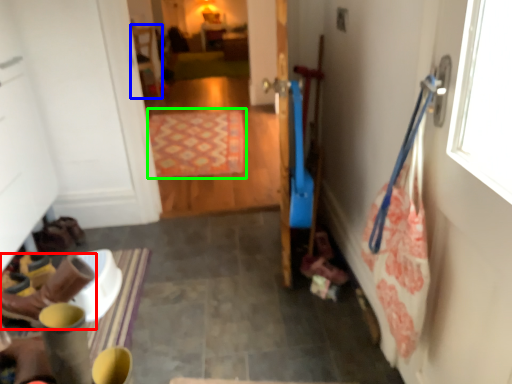
Question: Considering the real-world distances, which object is closest to footwear (highlighted by a red box)? chair (highlighted by a blue box) or mat (highlighted by a green box).

Choices:
 (A) chair
 (B) mat

Answer: (B)